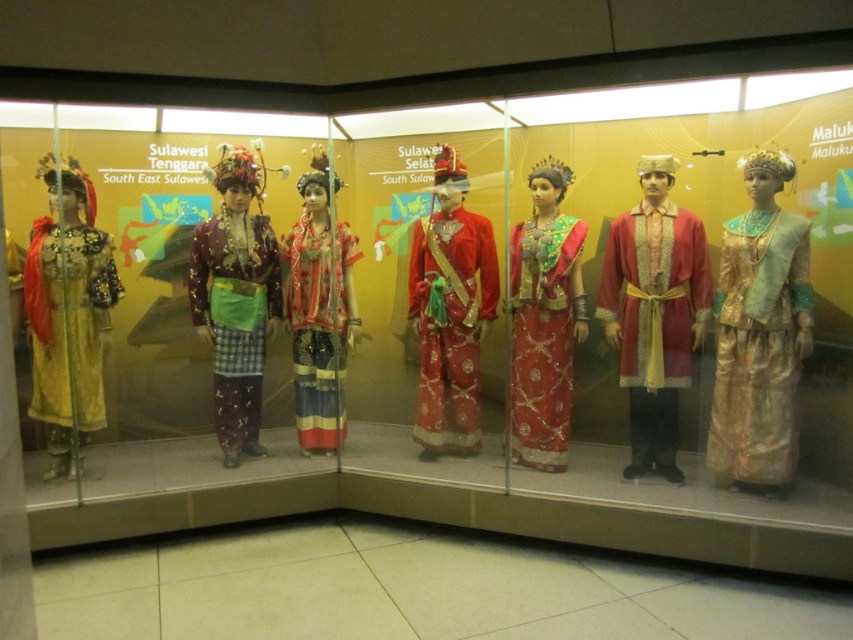
You are a curator who needs to install a new lighting fixture between the matte gold robe at center and the shiny red fabric at center. The fixture requires a minimum of 30 inches of space to be installed safely. Based on the display case layout, is there enough space to install the lighting fixture between them?

The distance between the matte gold robe at center and the shiny red fabric at center is 32.89 inches, which exceeds the required 30 inches. Therefore, there is sufficient space to install the lighting fixture safely between them.

You are standing in front of the display case and want to take a photo of both points. Which point is closer to you, point (236,291) or point (323,413)?

Point (236,291) is closer to the viewer than point (323,413).